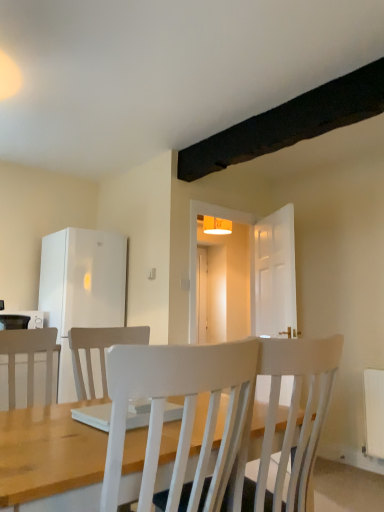
Question: Would you say white matte refrigerator at left is to the left or to the right of white textured chair at center in the picture?

Choices:
 (A) right
 (B) left

Answer: (B)

Question: Is white matte refrigerator at left wider or thinner than white textured chair at center?

Choices:
 (A) thin
 (B) wide

Answer: (B)

Question: Which object is the closest to the white glossy microwave at left?

Choices:
 (A) white textured chair at center
 (B) white matte refrigerator at left

Answer: (B)

Question: Which of these objects is positioned farthest from the white matte refrigerator at left?

Choices:
 (A) white glossy microwave at left
 (B) white textured chair at center

Answer: (B)